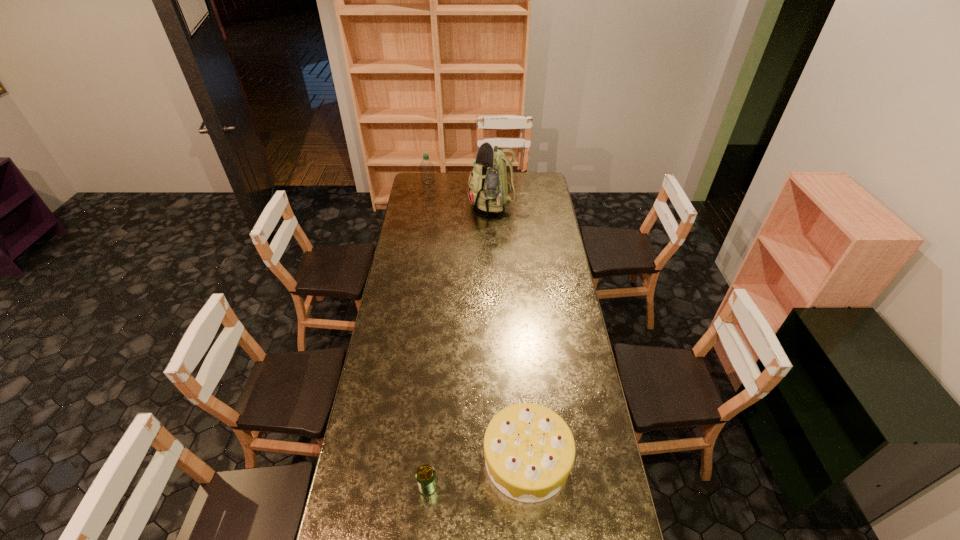
You are a GUI agent. You are given a task and a screenshot of the screen. Output one action in this format:
    pyautogui.click(x=<x>, y=<y>)
    Task: Click on the free space located 0.120m on the front of the leftmost object
    This screenshot has height=540, width=960.
    Given the screenshot: What is the action you would take?
    pyautogui.click(x=426, y=195)

You are a GUI agent. You are given a task and a screenshot of the screen. Output one action in this format:
    pyautogui.click(x=<x>, y=<y>)
    Task: Click on the blank space located 0.080m on the front of the birthday cake
    The height and width of the screenshot is (540, 960).
    Given the screenshot: What is the action you would take?
    pyautogui.click(x=533, y=532)

The image size is (960, 540). Find the location of `free space located 0.330m on the back of the second object from left to right`. free space located 0.330m on the back of the second object from left to right is located at coordinates (436, 392).

At what (x,y) coordinates should I click in order to perform the action: click on backpack that is at the far edge. Please return your answer as a coordinate pair (x, y). This screenshot has height=540, width=960. Looking at the image, I should click on (488, 188).

The image size is (960, 540). In order to click on water bottle at the far edge in this screenshot , I will do `click(426, 167)`.

This screenshot has width=960, height=540. Find the location of `object located in the left edge section of the desktop`. object located in the left edge section of the desktop is located at coordinates (426, 167).

Locate an element on the screen. backpack that is at the right edge is located at coordinates (488, 188).

This screenshot has height=540, width=960. Find the location of `birthday cake at the right edge`. birthday cake at the right edge is located at coordinates [x=529, y=450].

Locate an element on the screen. The image size is (960, 540). object situated at the far left corner is located at coordinates (426, 167).

Where is `object situated at the far right corner`? This screenshot has width=960, height=540. object situated at the far right corner is located at coordinates (488, 188).